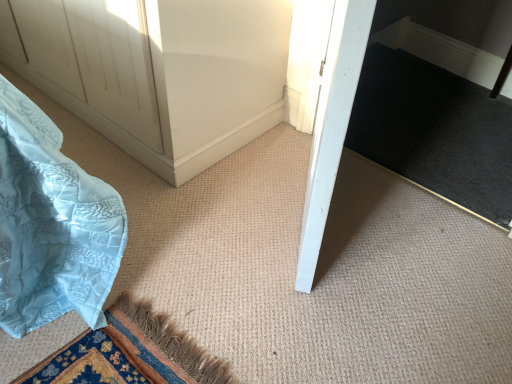
Identify the location of free spot to the left of white smooth door at center. (203, 208).